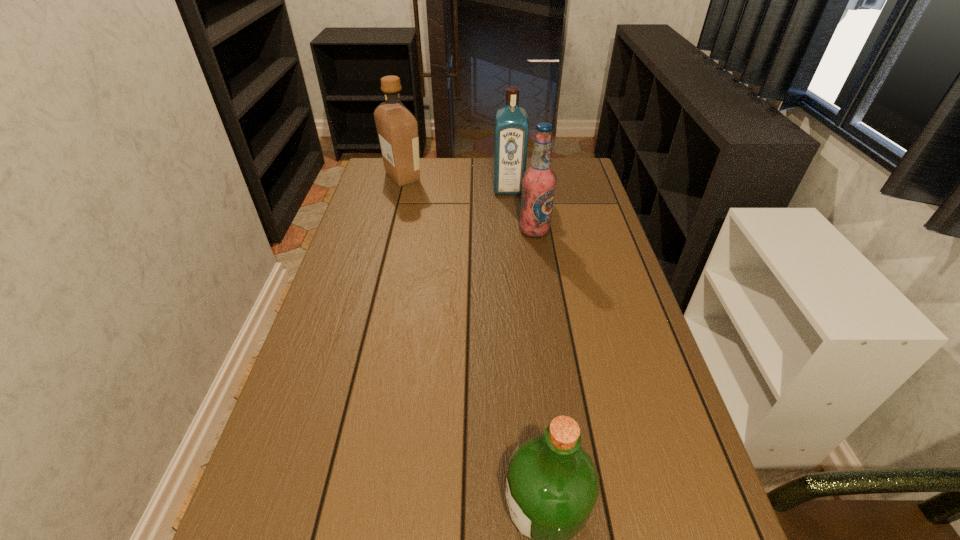
Identify the location of the leftmost object. (397, 128).

At what (x,y) coordinates should I click in order to perform the action: click on alcohol. Please return your answer as a coordinate pair (x, y). The width and height of the screenshot is (960, 540). Looking at the image, I should click on (539, 181).

Locate an element on the screen. Image resolution: width=960 pixels, height=540 pixels. vacant area situated 0.290m on the front-facing side of the leftmost object is located at coordinates (502, 177).

Identify the location of free space located on the front of the second nearest object. This screenshot has height=540, width=960. click(x=544, y=295).

Locate an element on the screen. This screenshot has height=540, width=960. object that is at the left edge is located at coordinates (397, 128).

Locate an element on the screen. This screenshot has width=960, height=540. object that is positioned at the far left corner is located at coordinates (397, 128).

Identify the location of vacant space at the far edge. This screenshot has height=540, width=960. coord(435,158).

This screenshot has width=960, height=540. In the image, there is a desktop. In order to click on vacant area at the left edge in this screenshot , I will do `click(348, 312)`.

Identify the location of free space at the right edge of the desktop. The image size is (960, 540). (679, 451).

Image resolution: width=960 pixels, height=540 pixels. I want to click on free space at the far left corner of the desktop, so click(374, 173).